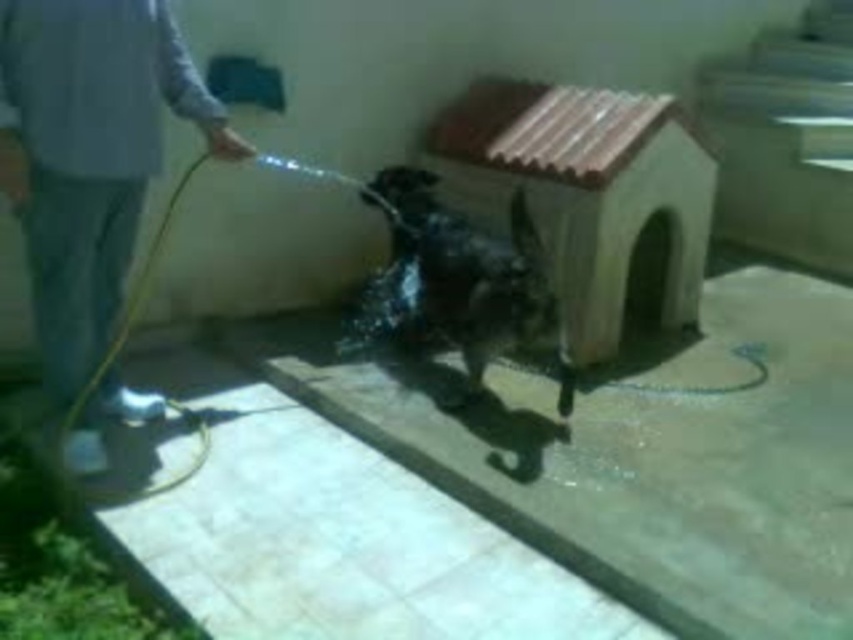
This screenshot has height=640, width=853. Describe the element at coordinates (88, 156) in the screenshot. I see `gray fabric pants at lower left` at that location.

Who is positioned more to the left, gray fabric pants at lower left or glossy plastic garden hose at lower left?

gray fabric pants at lower left

Which is behind, point (86, 320) or point (109, 497)?

Point (86, 320)

What are the coordinates of `gray fabric pants at lower left` in the screenshot? It's located at (88, 156).

Based on the photo, is gray fabric pants at lower left positioned in front of wet fur dog at center?

Yes, it is.

Does gray fabric pants at lower left have a larger size compared to wet fur dog at center?

Actually, gray fabric pants at lower left might be smaller than wet fur dog at center.

The height and width of the screenshot is (640, 853). Describe the element at coordinates (88, 156) in the screenshot. I see `gray fabric pants at lower left` at that location.

You are a GUI agent. You are given a task and a screenshot of the screen. Output one action in this format:
    pyautogui.click(x=<x>, y=<y>)
    Task: Click on the gray fabric pants at lower left
    
    Given the screenshot: What is the action you would take?
    pyautogui.click(x=88, y=156)

From the picture: Does wet fur dog at center have a smaller size compared to glossy plastic garden hose at lower left?

Actually, wet fur dog at center might be larger than glossy plastic garden hose at lower left.

Can you confirm if wet fur dog at center is wider than glossy plastic garden hose at lower left?

Indeed, wet fur dog at center has a greater width compared to glossy plastic garden hose at lower left.

Which is behind, point (527, 259) or point (100, 500)?

The point (527, 259) is more distant.

Image resolution: width=853 pixels, height=640 pixels. I want to click on wet fur dog at center, so click(451, 280).